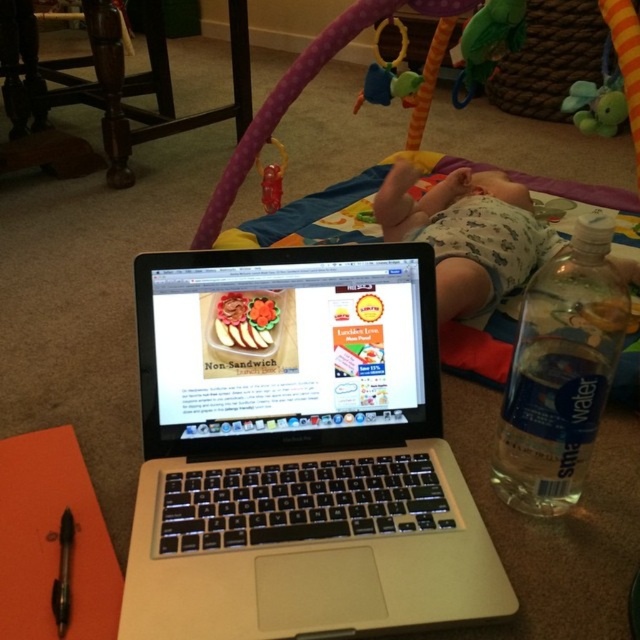
You are a parent who wants to hand the translucent plastic teething ring at upper center to your baby who is lying under the baby activity gym. The translucent plastic water bottle at right is on the table next to you. If you extend your arm to reach the teething ring, will the water bottle interfere with your reach?

The distance between the translucent plastic water bottle at right and the translucent plastic teething ring at upper center is 22.61 inches. Since the water bottle is 22.61 inches away from the teething ring, it is unlikely to interfere with your reach as they are sufficiently spaced apart.